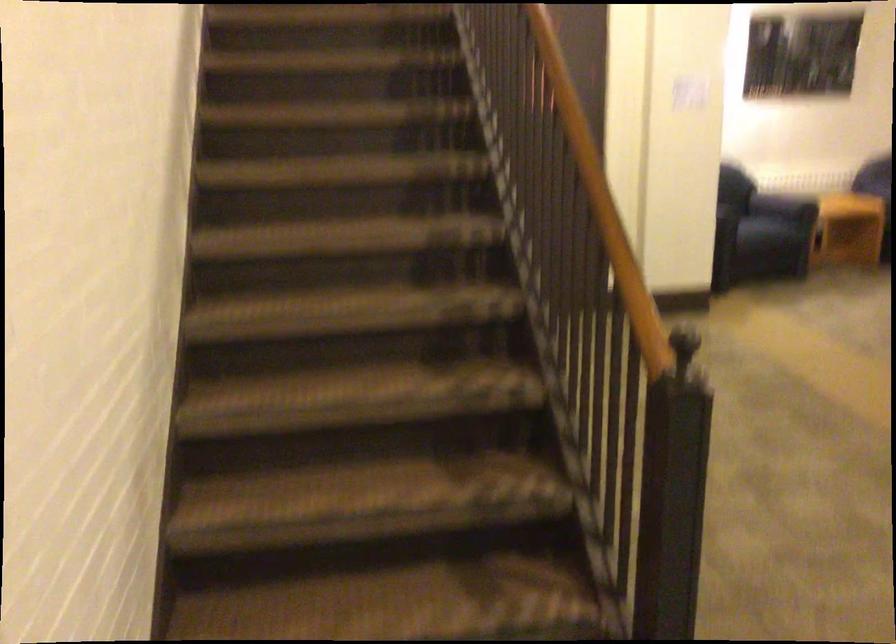
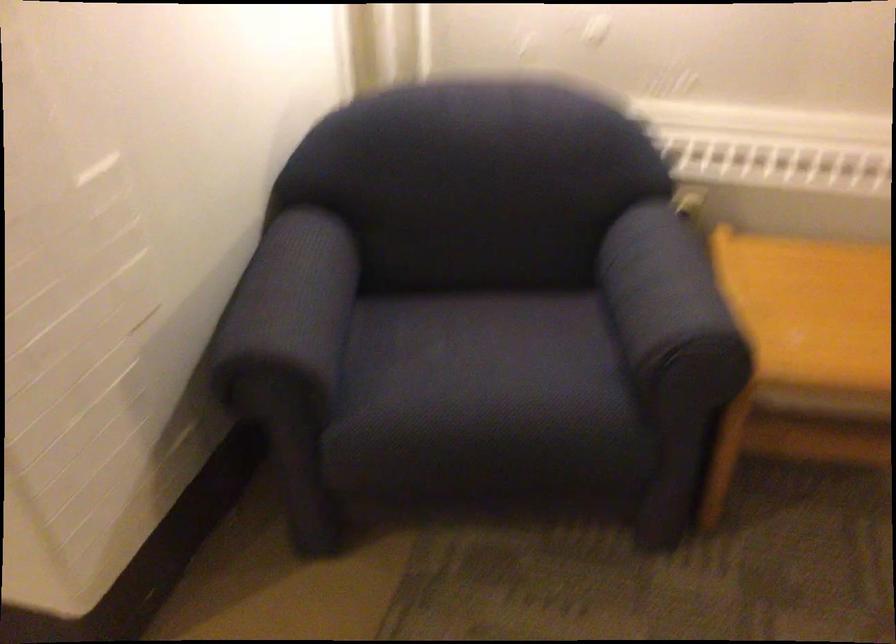
The point at (x=731, y=200) is marked in the first image. Where is the corresponding point in the second image?

(289, 307)